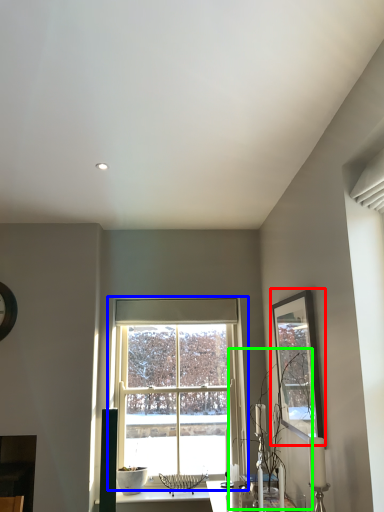
Question: Which object is the closest to the picture frame (highlighted by a red box)? Choose among these: window (highlighted by a blue box) or plant (highlighted by a green box).

Choices:
 (A) window
 (B) plant

Answer: (B)